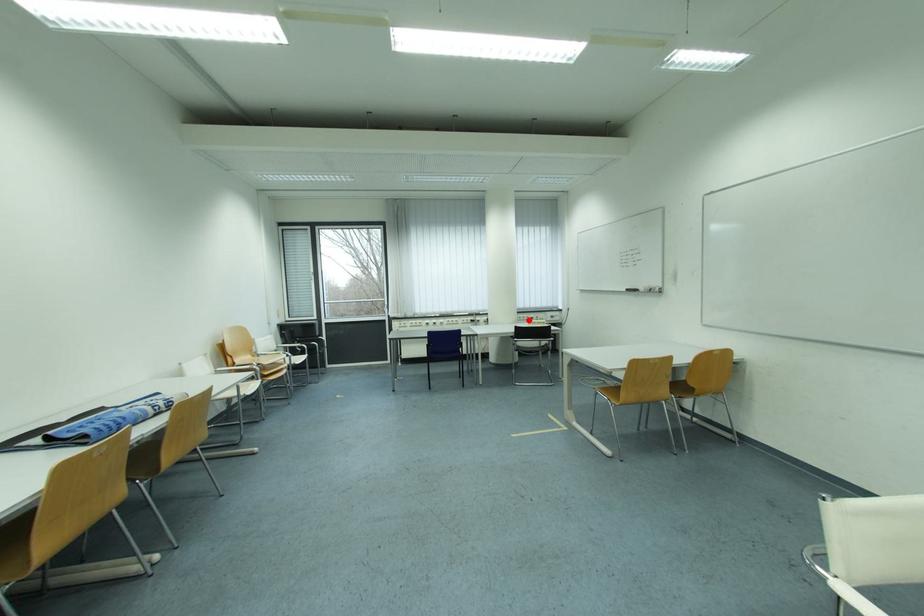
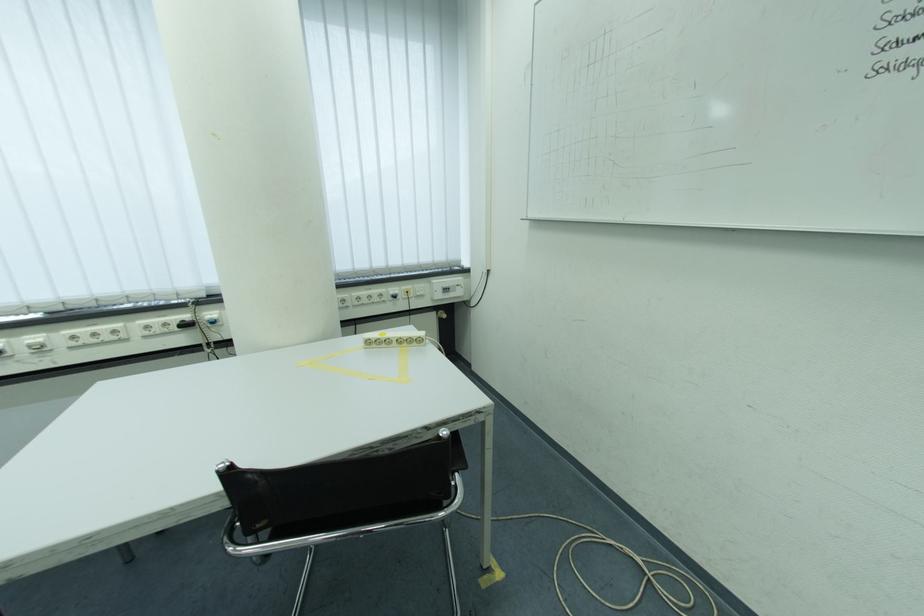
Find the pixel in the second image that matches the highlighted location in the first image.

(368, 301)